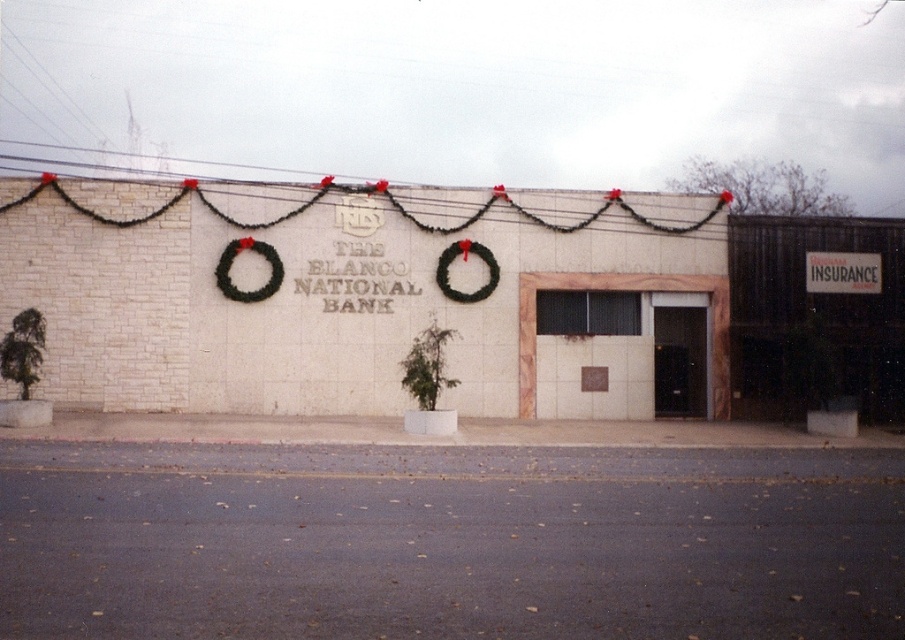
Who is shorter, green leafy wreath at upper center or green leafy wreath at center?

With less height is green leafy wreath at center.

What do you see at coordinates (232, 262) in the screenshot? Image resolution: width=905 pixels, height=640 pixels. I see `green leafy wreath at upper center` at bounding box center [232, 262].

Find the location of a particular element. The height and width of the screenshot is (640, 905). green leafy wreath at upper center is located at coordinates (232, 262).